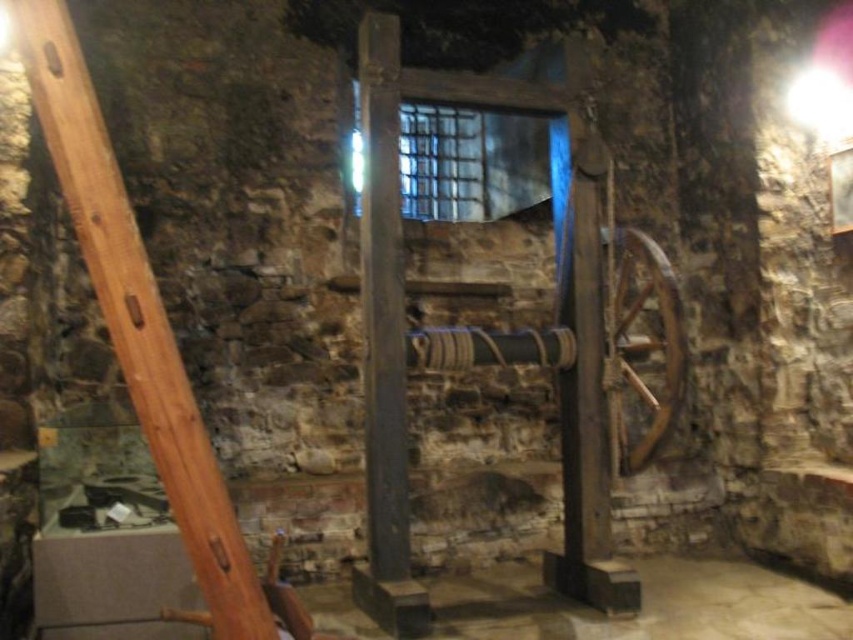
You are an architect examining the medieval interior. You need to determine the spatial relationship between the smooth wooden pole at left and the smooth dark wood pillar at center. Which object is positioned lower in the image?

The smooth wooden pole at left is located below the smooth dark wood pillar at center, so it is positioned lower in the image.

You are an architect designing a new medieval theme room and need to place a decorative item between the smooth wooden pole at left and the smooth dark wood pillar at center. Which object has a larger width to ensure the decorative item fits better?

The smooth wooden pole at left has a greater width than the smooth dark wood pillar at center, so placing the decorative item next to it would provide better stability and fit.